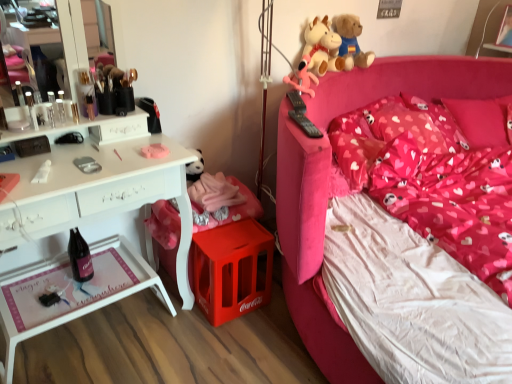
Question: Looking at the image, does soft plush cow at upper right, which is the 2th toy from back to front, seem bigger or smaller compared to heart-patterned fabric pillow at upper right, the third pillow when ordered from left to right?

Choices:
 (A) big
 (B) small

Answer: (B)

Question: Considering the positions of point (340, 41) and point (496, 104), is point (340, 41) closer or farther from the camera than point (496, 104)?

Choices:
 (A) farther
 (B) closer

Answer: (B)

Question: Which of these objects is positioned farthest from the pink fabric pillow at upper right, the 1th pillow when ordered from left to right?

Choices:
 (A) matte pink plush at upper right, which appears as the first toy when viewed from the front
 (B) heart-patterned fabric pillow at upper right, which is the second pillow from right to left
 (C) pink fabric bed at right
 (D) soft plush cow at upper right, which ranks as the 2th toy in front-to-back order
 (E) black glass bottle at lower left

Answer: (E)

Question: Which object is positioned farthest from the soft plush toys at upper right, the 1th toy when ordered from back to front?

Choices:
 (A) black glass bottle at lower left
 (B) matte pink mattress at center
 (C) matte pink plush at upper right, which appears as the first toy when viewed from the front
 (D) heart-patterned fabric pillow at upper right, which appears as the first pillow when viewed from the right
 (E) heart-patterned fabric pillow at upper right, which is the second pillow from right to left

Answer: (A)